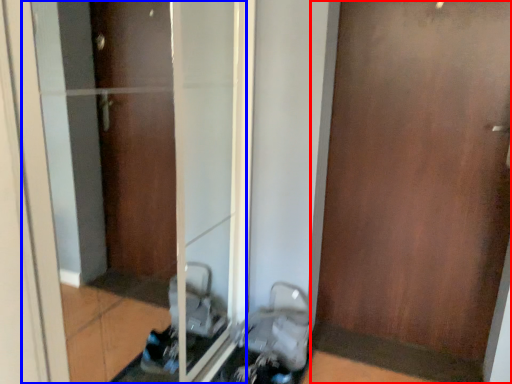
Question: Which point is closer to the camera, door (highlighted by a red box) or glass door (highlighted by a blue box)?

Choices:
 (A) door
 (B) glass door

Answer: (B)